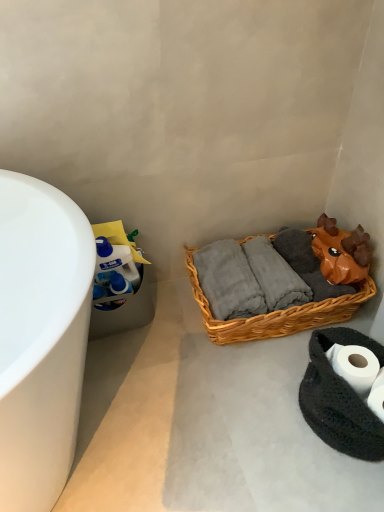
This screenshot has width=384, height=512. I want to click on empty space that is ontop of black knitted rug at lower right (from a real-world perspective), so click(x=356, y=362).